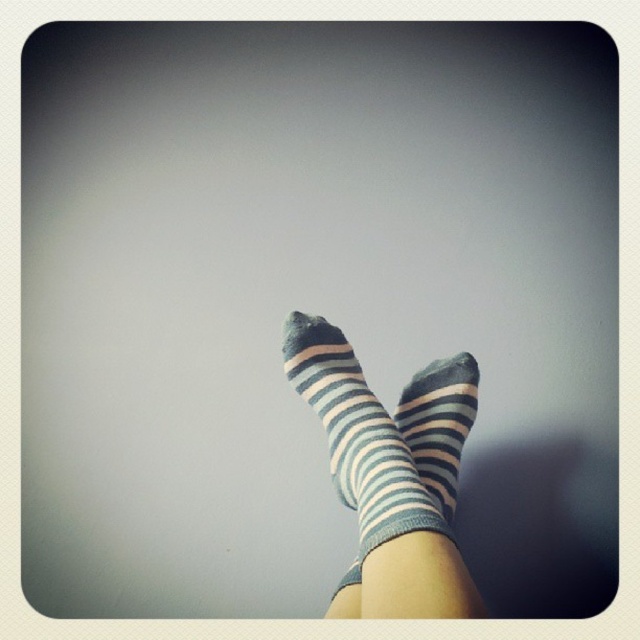
Question: Which point is closer to the camera?

Choices:
 (A) blue striped socks at center
 (B) striped cotton socks at center

Answer: (A)

Question: Which point appears farthest from the camera in this image?

Choices:
 (A) (417, 525)
 (B) (440, 419)

Answer: (B)

Question: Can you confirm if blue striped socks at center is smaller than striped cotton socks at center?

Choices:
 (A) no
 (B) yes

Answer: (A)

Question: Among these objects, which one is nearest to the camera?

Choices:
 (A) blue striped socks at center
 (B) striped cotton socks at center

Answer: (A)

Question: Is blue striped socks at center smaller than striped cotton socks at center?

Choices:
 (A) no
 (B) yes

Answer: (A)

Question: Is blue striped socks at center bigger than striped cotton socks at center?

Choices:
 (A) no
 (B) yes

Answer: (B)